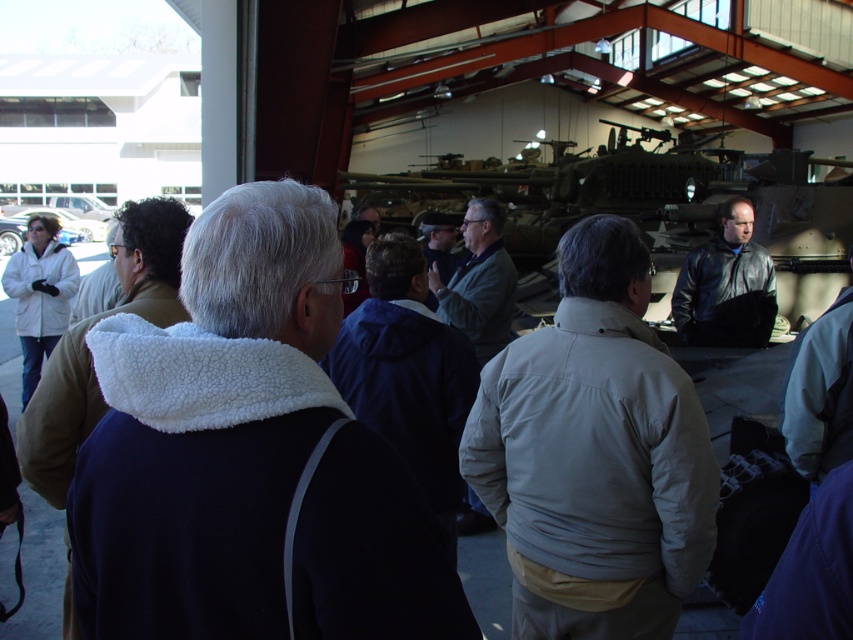
Question: Which point is closer to the camera?

Choices:
 (A) light gray jacket at center
 (B) white fleece jacket at left
 (C) black leather jacket at center
 (D) camouflage paint tank at center

Answer: (A)

Question: Does light gray jacket at center have a greater width compared to white fleece jacket at left?

Choices:
 (A) no
 (B) yes

Answer: (B)

Question: Which of the following is the closest to the observer?

Choices:
 (A) (44, 220)
 (B) (675, 314)
 (C) (619, 547)

Answer: (C)

Question: Can you confirm if light gray jacket at center is positioned to the right of camouflage paint tank at center?

Choices:
 (A) yes
 (B) no

Answer: (B)

Question: Does camouflage paint tank at center have a larger size compared to black leather jacket at center?

Choices:
 (A) no
 (B) yes

Answer: (B)

Question: Which of the following is the farthest from the observer?

Choices:
 (A) white fleece jacket at left
 (B) black leather jacket at center
 (C) camouflage paint tank at center

Answer: (A)